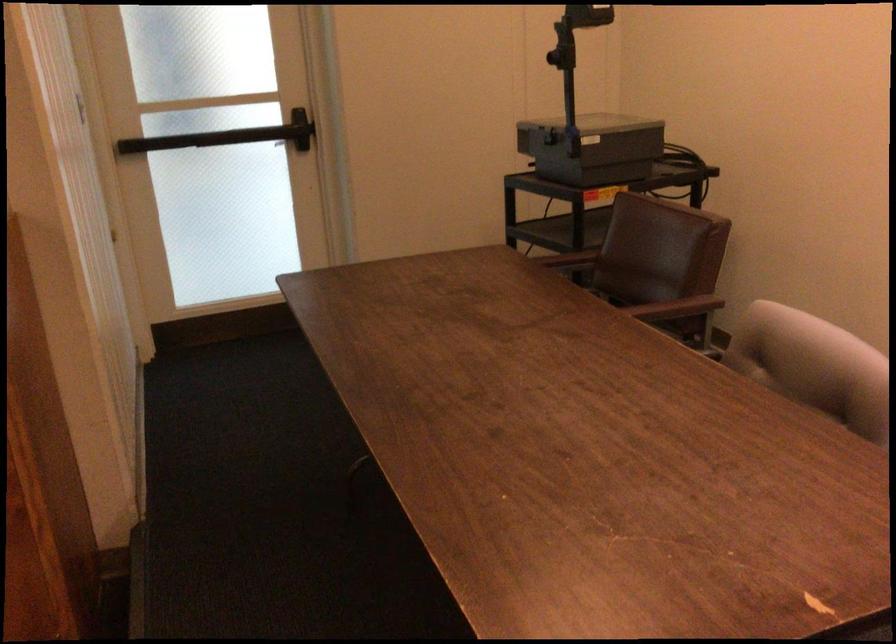
What do you see at coordinates (677, 308) in the screenshot? I see `the brown chair armrest` at bounding box center [677, 308].